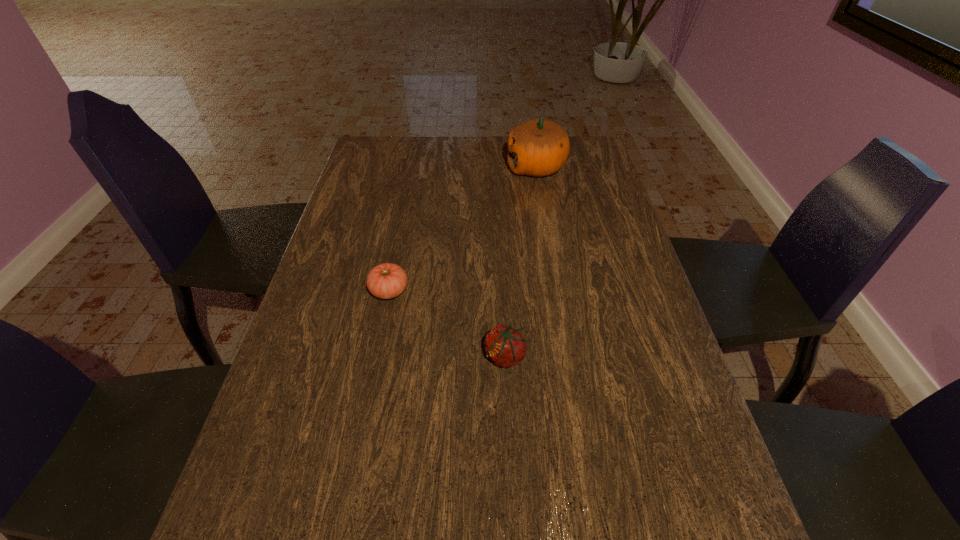
Find the location of a particular element. pumpkin is located at coordinates (538, 147).

Where is `the tallest object`? This screenshot has height=540, width=960. the tallest object is located at coordinates click(538, 147).

I want to click on the right tomato, so click(505, 346).

At what (x,y) coordinates should I click in order to perform the action: click on the nearest object. Please return your answer as a coordinate pair (x, y). This screenshot has height=540, width=960. Looking at the image, I should click on (505, 346).

In order to click on the second nearest object in this screenshot , I will do `click(385, 281)`.

Where is `the leftmost object`? the leftmost object is located at coordinates (385, 281).

The height and width of the screenshot is (540, 960). Find the location of `free space located on the face of the pumpkin`. free space located on the face of the pumpkin is located at coordinates (411, 167).

The image size is (960, 540). I want to click on free region located on the face of the pumpkin, so click(454, 167).

Where is `vacant space located on the face of the pumpkin`? The image size is (960, 540). vacant space located on the face of the pumpkin is located at coordinates (434, 167).

Locate an element on the screen. This screenshot has height=540, width=960. vacant space positioned on the back of the nearer tomato is located at coordinates (500, 266).